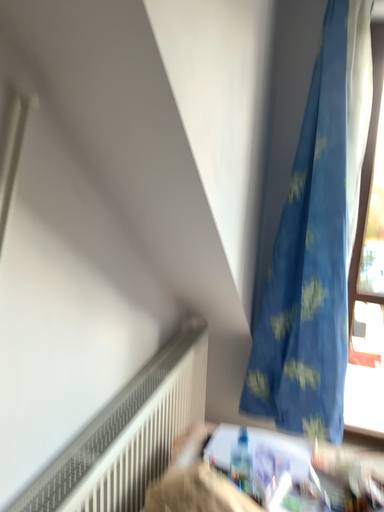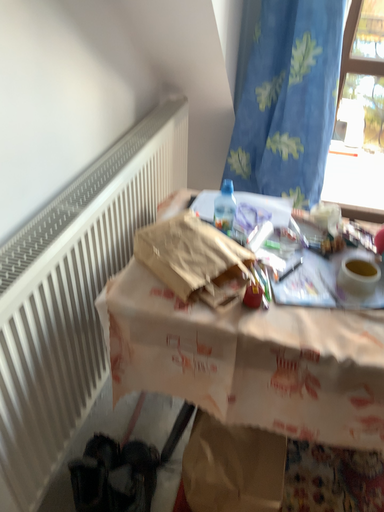
Question: Which way did the camera rotate in the video?

Choices:
 (A) rotated upward
 (B) rotated downward

Answer: (B)